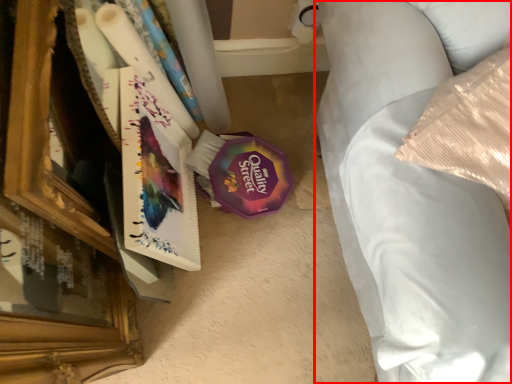
Question: Where is furniture (annotated by the red box) located in relation to paperback book in the image?

Choices:
 (A) right
 (B) left

Answer: (A)